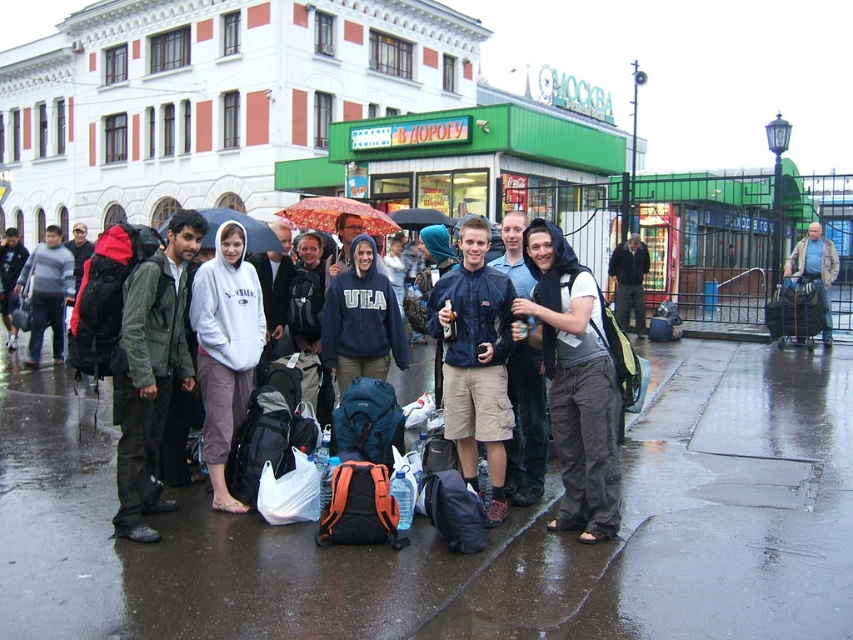
Who is positioned more to the right, matte blue jacket at center or gray fleece hoodie at center?

From the viewer's perspective, matte blue jacket at center appears more on the right side.

Does matte blue jacket at center have a lesser height compared to gray fleece hoodie at center?

No.

Who is more distant from viewer, (474,401) or (229,304)?

Positioned behind is point (229,304).

The width and height of the screenshot is (853, 640). In order to click on matte blue jacket at center in this screenshot , I will do `click(476, 358)`.

Which is below, wet asphalt pavement at lower center or blue fabric umbrella at center?

wet asphalt pavement at lower center is lower down.

Which of these two, wet asphalt pavement at lower center or blue fabric umbrella at center, stands taller?

Standing taller between the two is blue fabric umbrella at center.

Which is in front, point (125, 634) or point (245, 244)?

Positioned in front is point (125, 634).

I want to click on wet asphalt pavement at lower center, so click(x=489, y=532).

Between point (821, 276) and point (368, 220), which one is positioned behind?

Point (821, 276)

Based on the photo, is denim jacket at right above red fabric umbrella at center?

No, denim jacket at right is not above red fabric umbrella at center.

This screenshot has width=853, height=640. I want to click on denim jacket at right, so click(815, 269).